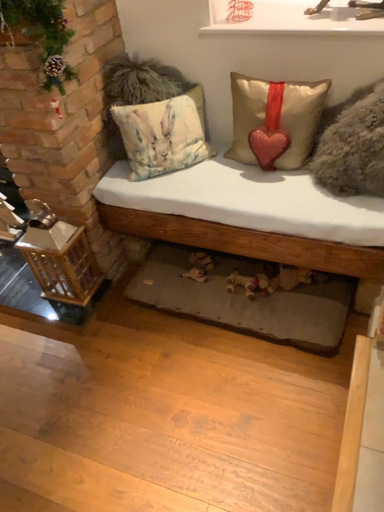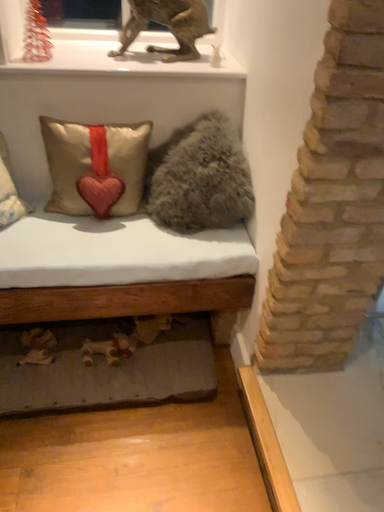
Question: How did the camera likely rotate when shooting the video?

Choices:
 (A) rotated left
 (B) rotated right

Answer: (B)